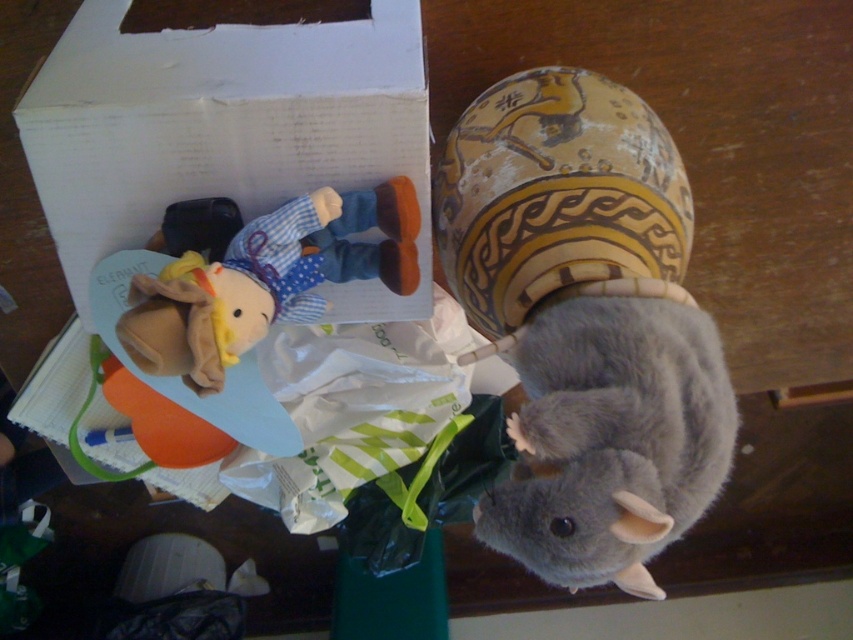
You are organizing the cluttered table and need to place the gray soft plush at lower right and the fluffy yellow plush at center into their respective boxes. Which plush toy should you pick up first to avoid blocking the other?

You should pick up the gray soft plush at lower right first because it is below the fluffy yellow plush at center, so lifting the lower one first will prevent blocking access to the upper one.

You are a delivery robot trying to navigate around the cluttered table. You need to move from the white cardboard box to the red and white striped item. The path must avoid the green plastic bag. There are two points marked on the table, point A at coordinates point (366, 307) and point B at coordinates point (572, 474). Which point is closer to you as you approach the table?

Point A at coordinates point (366, 307) is closer to you because it is further to the viewer than point B at coordinates point (572, 474).